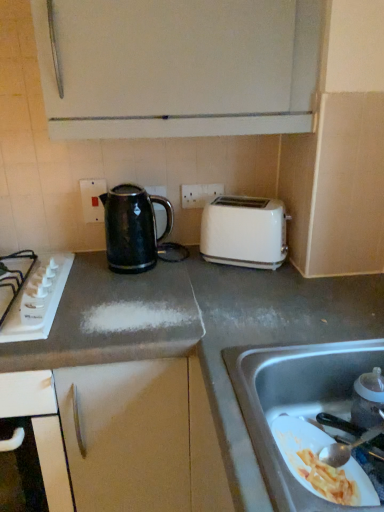
The image size is (384, 512). I want to click on free space to the left of black glossy kettle at center, so click(87, 265).